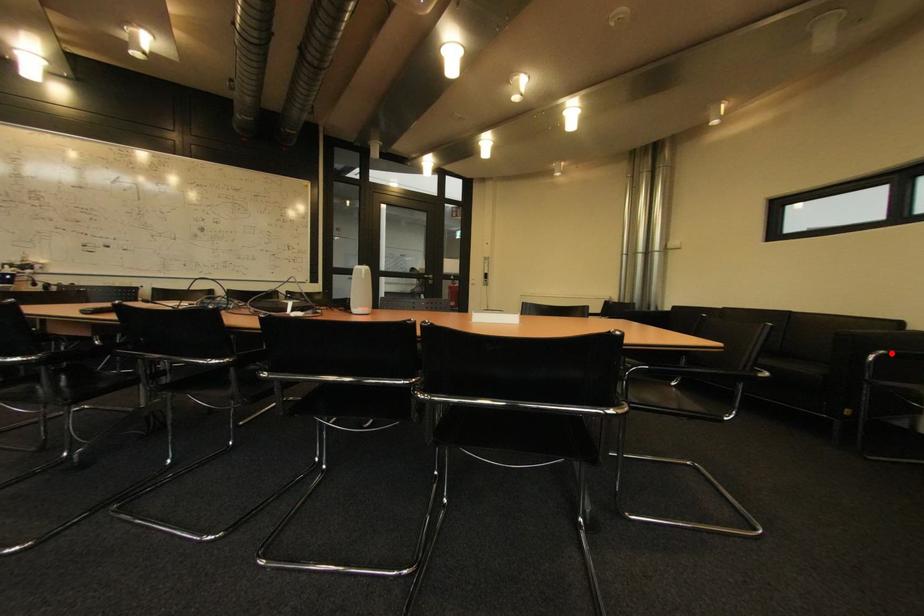
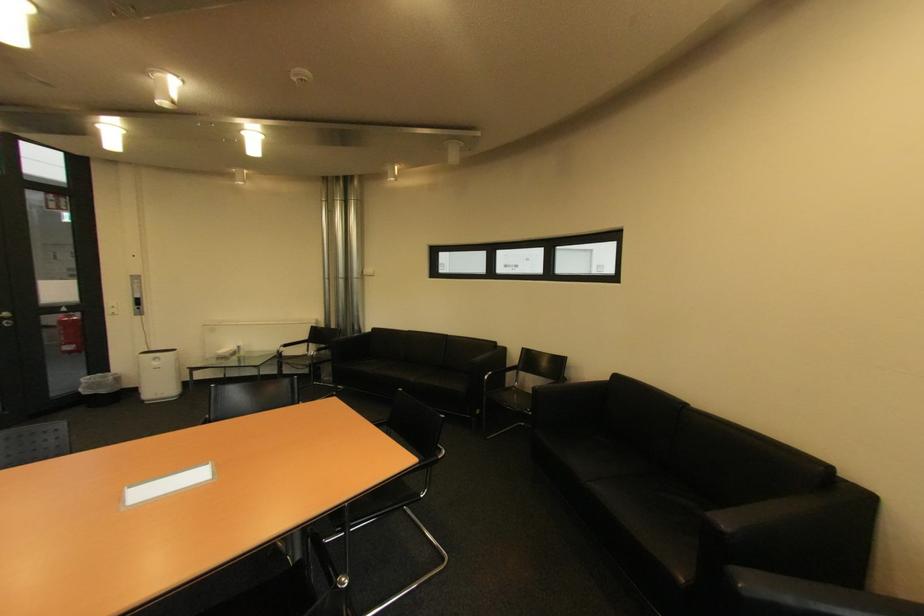
Locate, in the second image, the point that corresponds to the highlighted location in the first image.

(499, 374)